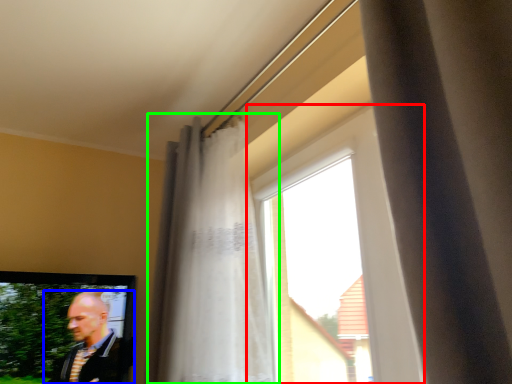
Question: Which is nearer to the window (highlighted by a red box)? man (highlighted by a blue box) or curtain (highlighted by a green box).

Choices:
 (A) man
 (B) curtain

Answer: (B)